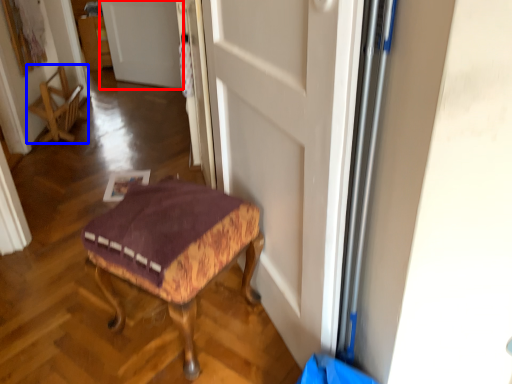
Question: Among these objects, which one is farthest to the camera, door (highlighted by a red box) or chair (highlighted by a blue box)?

Choices:
 (A) door
 (B) chair

Answer: (A)